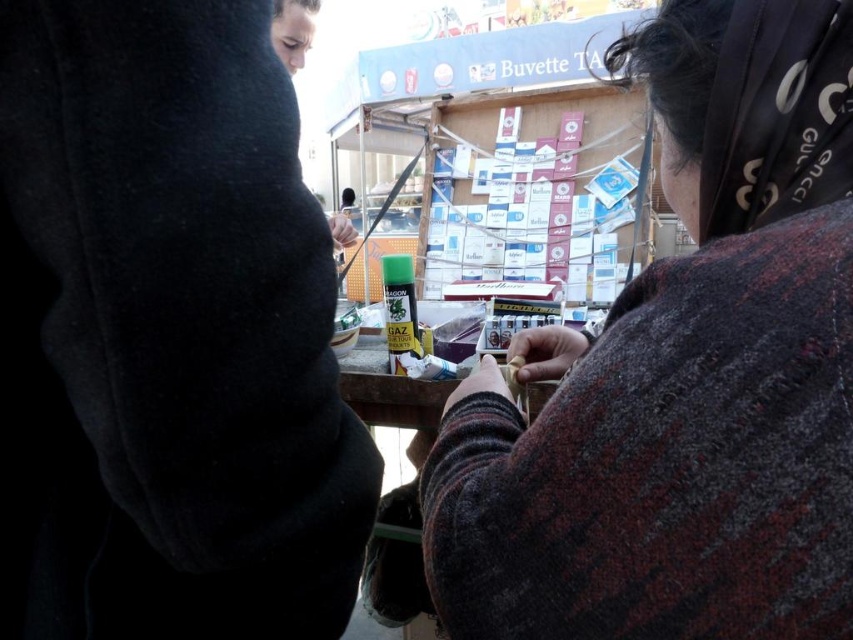
Question: Is knitted wool sweater at center thinner than black fabric headscarf at upper right?

Choices:
 (A) no
 (B) yes

Answer: (A)

Question: Considering the real-world distances, which object is closest to the black fabric headscarf at upper right?

Choices:
 (A) black fleece sweatshirt at left
 (B) knitted wool sweater at center

Answer: (B)

Question: Which of these objects is positioned closest to the knitted wool sweater at center?

Choices:
 (A) black fleece sweatshirt at left
 (B) black fabric headscarf at upper right

Answer: (B)

Question: In this image, where is black fleece sweatshirt at left located relative to black fabric headscarf at upper right?

Choices:
 (A) above
 (B) below

Answer: (B)

Question: Does knitted wool sweater at center appear over black fabric headscarf at upper right?

Choices:
 (A) no
 (B) yes

Answer: (A)

Question: Which of the following is the closest to the observer?

Choices:
 (A) black fabric headscarf at upper right
 (B) knitted wool sweater at center
 (C) black fleece sweatshirt at left

Answer: (C)